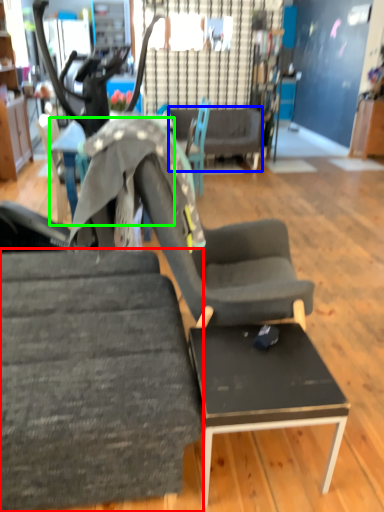
Question: Considering the real-world distances, which object is farthest from chair (highlighted by a red box)? couch (highlighted by a blue box) or table (highlighted by a green box)?

Choices:
 (A) couch
 (B) table

Answer: (A)